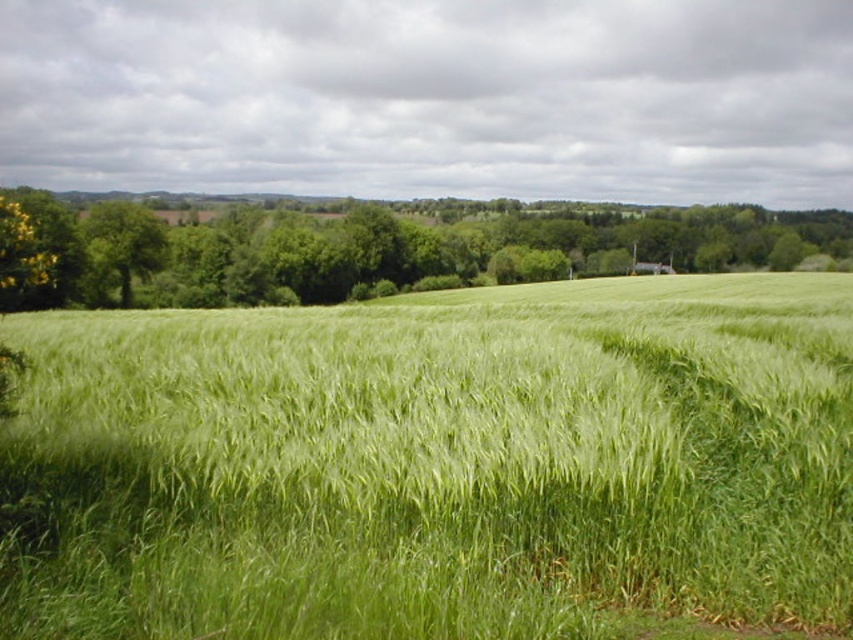
You are standing at the origin point in the image. Where is the green grassy wheat field at center located?

The green grassy wheat field at center is located at point (x=438, y=464).

You are standing in the middle of a large field and see two trees, the green leafy tree at center and the green leafy tree at left. If you want to walk from one tree to the other, how far will you have to walk?

The distance between the green leafy tree at center and the green leafy tree at left is 45.67 meters, so you will have to walk 45.67 meters to go from one tree to the other.

You are standing in the middle of the green grassy wheat field at center and want to reach the green leafy tree at center. Which direction should you walk to get closer to the tree?

You should walk towards the direction away from the green grassy wheat field at center because the green leafy tree at center is behind the green grassy wheat field at center.